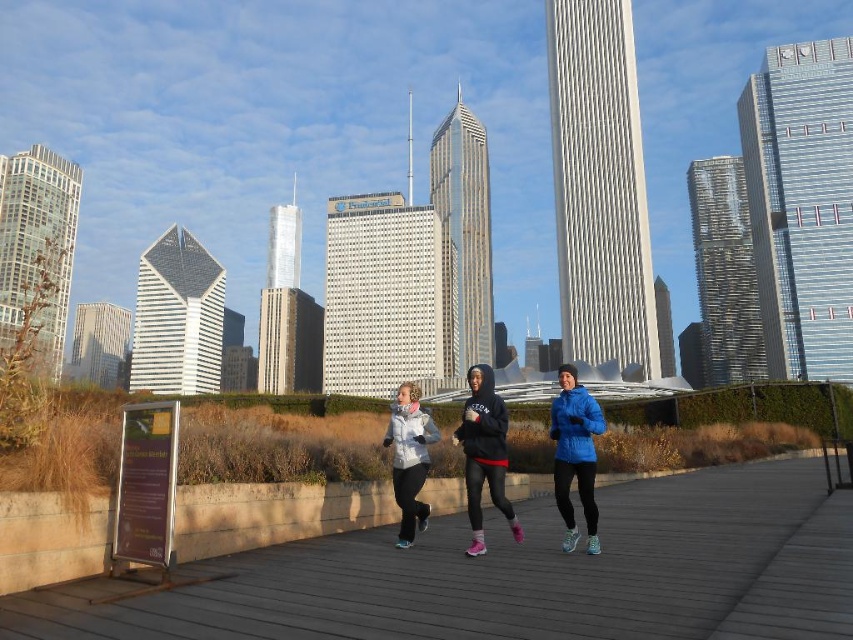
Question: Which of the following is the farthest from the observer?

Choices:
 (A) (502, 422)
 (B) (575, 524)
 (C) (444, 545)
 (D) (402, 468)

Answer: (D)

Question: Does wooden boardwalk at center come in front of black hoodie at center?

Choices:
 (A) no
 (B) yes

Answer: (B)

Question: Which point is closer to the camera?

Choices:
 (A) matte white jacket at center
 (B) blue down jacket at center
 (C) wooden boardwalk at center
 (D) black hoodie at center

Answer: (C)

Question: Can you confirm if wooden boardwalk at center is wider than matte white jacket at center?

Choices:
 (A) yes
 (B) no

Answer: (A)

Question: Is blue down jacket at center below black hoodie at center?

Choices:
 (A) no
 (B) yes

Answer: (B)

Question: Which is farther from the black hoodie at center?

Choices:
 (A) blue down jacket at center
 (B) wooden boardwalk at center

Answer: (B)